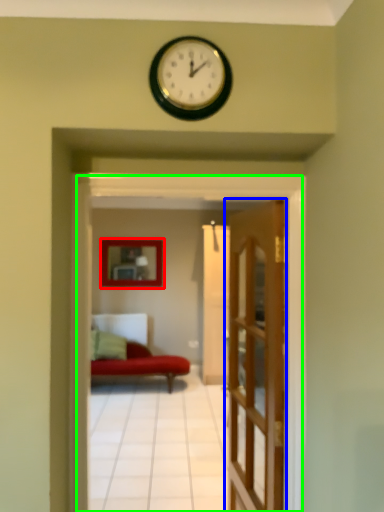
Question: Estimate the real-world distances between objects in this image. Which object is closer to picture frame (highlighted by a red box), door (highlighted by a blue box) or residence (highlighted by a green box)?

Choices:
 (A) door
 (B) residence

Answer: (A)